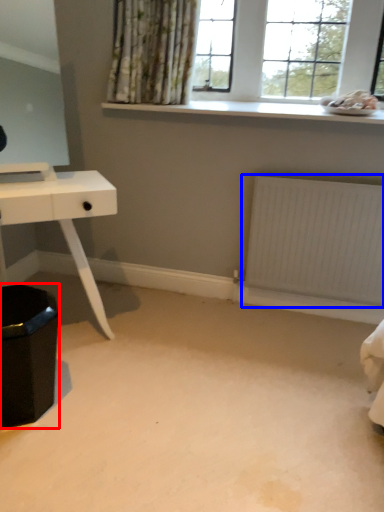
Question: Which point is closer to the camera, step stool (highlighted by a red box) or radiator (highlighted by a blue box)?

Choices:
 (A) step stool
 (B) radiator

Answer: (A)